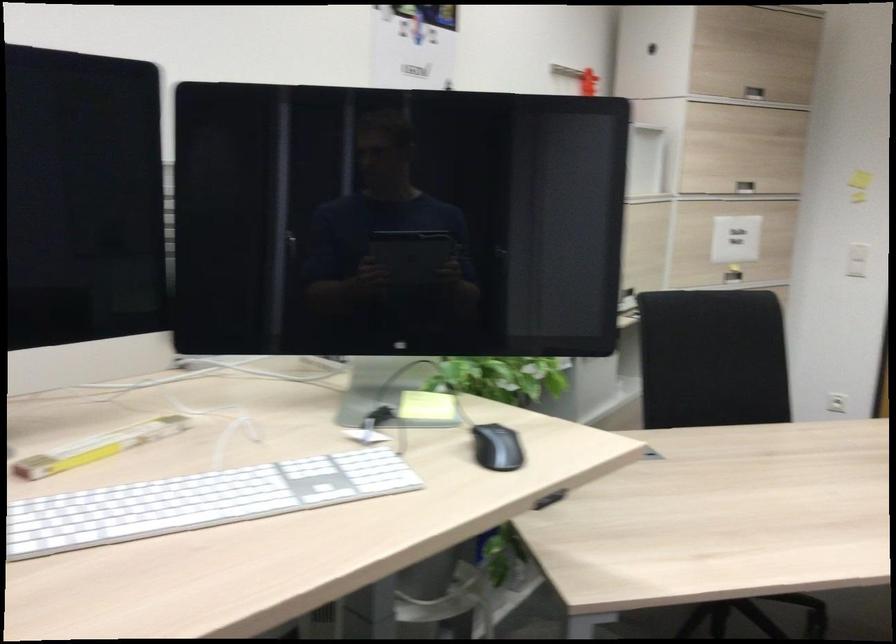
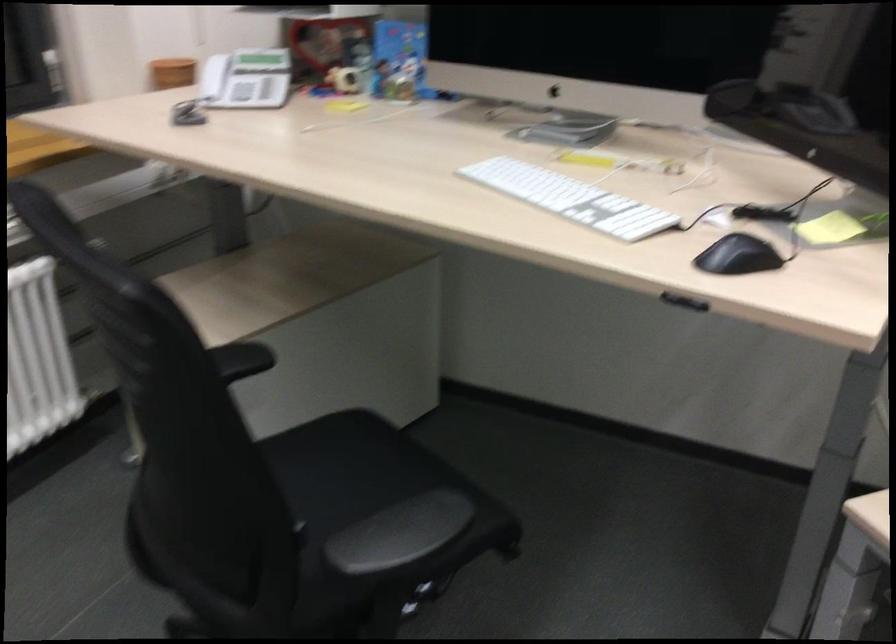
The point at (497, 449) is marked in the first image. Where is the corresponding point in the second image?

(737, 256)